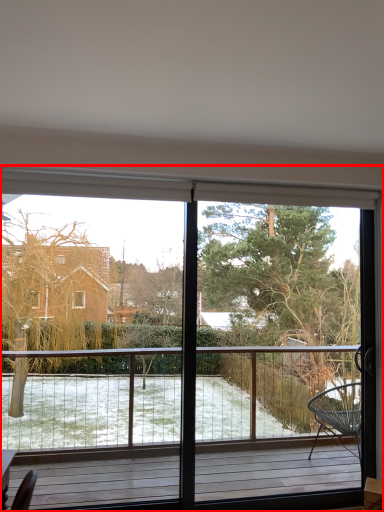
Question: From the image's perspective, what is the correct spatial positioning of window (annotated by the red box) in reference to tree?

Choices:
 (A) above
 (B) below

Answer: (B)